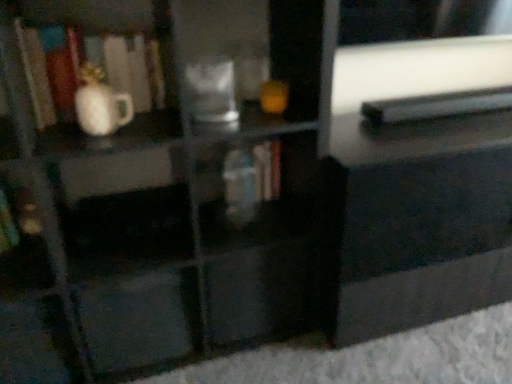
Question: From a real-world perspective, is hardcover book at center, the second book viewed from the left, over black glossy drawer at center, the 2th drawer viewed from the left?

Choices:
 (A) yes
 (B) no

Answer: (A)

Question: Does hardcover book at center, the second book viewed from the left, turn towards black glossy drawer at center, the 2th drawer viewed from the left?

Choices:
 (A) yes
 (B) no

Answer: (B)

Question: Considering the relative sizes of hardcover book at center, which is the 2th book from right to left, and black glossy drawer at center, the 2th drawer viewed from the left, in the image provided, is hardcover book at center, which is the 2th book from right to left, thinner than black glossy drawer at center, the 2th drawer viewed from the left,?

Choices:
 (A) no
 (B) yes

Answer: (B)

Question: Does hardcover book at center, which is the 2th book from right to left, have a lesser height compared to black glossy drawer at center, which is the 1th drawer from right to left?

Choices:
 (A) no
 (B) yes

Answer: (B)

Question: Is hardcover book at center, the second book viewed from the left, next to black glossy drawer at center, the 2th drawer viewed from the left?

Choices:
 (A) yes
 (B) no

Answer: (B)

Question: Is hardcover book at center, the second book viewed from the left, further to camera compared to black glossy drawer at center, the 2th drawer viewed from the left?

Choices:
 (A) no
 (B) yes

Answer: (B)

Question: Considering the relative sizes of matte black drawer at center, which is counted as the 2th drawer, starting from the right, and hardcover book at center, the second book viewed from the left, in the image provided, is matte black drawer at center, which is counted as the 2th drawer, starting from the right, wider than hardcover book at center, the second book viewed from the left,?

Choices:
 (A) yes
 (B) no

Answer: (A)

Question: Is hardcover book at center, which is the 2th book from right to left, inside matte black drawer at center, the first drawer positioned from the left?

Choices:
 (A) no
 (B) yes

Answer: (A)

Question: Can you confirm if matte black drawer at center, the first drawer positioned from the left, is taller than hardcover book at center, the second book viewed from the left?

Choices:
 (A) yes
 (B) no

Answer: (A)

Question: Is matte black drawer at center, which is counted as the 2th drawer, starting from the right, completely or partially outside of hardcover book at center, which is the 2th book from right to left?

Choices:
 (A) yes
 (B) no

Answer: (A)

Question: From the image's perspective, does matte black drawer at center, the first drawer positioned from the left, appear higher than hardcover book at center, the second book viewed from the left?

Choices:
 (A) yes
 (B) no

Answer: (B)

Question: Is matte black drawer at center, which is counted as the 2th drawer, starting from the right, far away from hardcover book at center, which is the 2th book from right to left?

Choices:
 (A) no
 (B) yes

Answer: (A)

Question: Can you see white glossy vase at left touching black plastic book at upper right, positioned as the 1th book in right-to-left order?

Choices:
 (A) no
 (B) yes

Answer: (A)